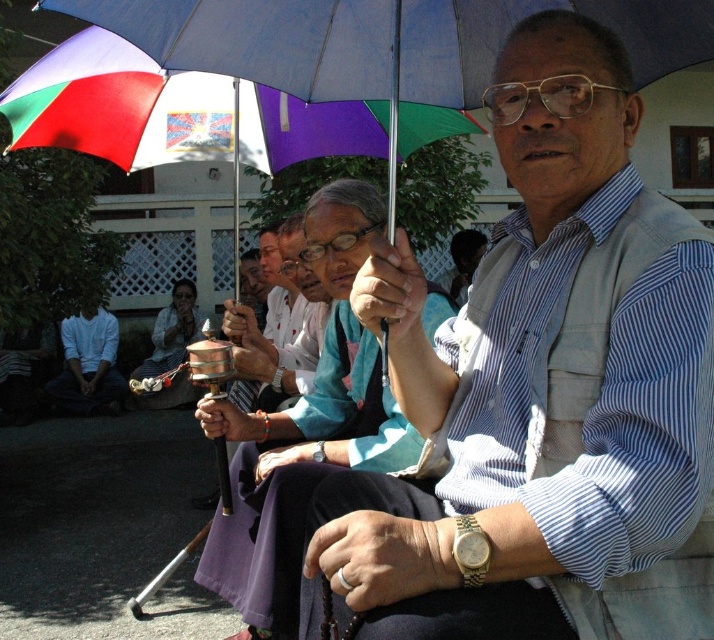
Who is positioned more to the left, matte blue shirt at center or white matte shirt at lower left?

Positioned to the left is white matte shirt at lower left.

Who is higher up, matte blue shirt at center or white matte shirt at lower left?

matte blue shirt at center is higher up.

Image resolution: width=714 pixels, height=640 pixels. What do you see at coordinates (527, 387) in the screenshot? I see `matte blue shirt at center` at bounding box center [527, 387].

At what (x,y) coordinates should I click in order to perform the action: click on matte blue shirt at center. Please return your answer as a coordinate pair (x, y). Looking at the image, I should click on (527, 387).

Does matte blue shirt at center have a lesser height compared to multicolored fabric umbrella at upper center?

No, matte blue shirt at center is not shorter than multicolored fabric umbrella at upper center.

Can you confirm if matte blue shirt at center is positioned to the left of multicolored fabric umbrella at upper center?

No, matte blue shirt at center is not to the left of multicolored fabric umbrella at upper center.

Measure the distance between matte blue shirt at center and camera.

matte blue shirt at center and camera are 1.17 meters apart from each other.

Find the location of `matte blue shirt at center`. matte blue shirt at center is located at coordinates (527, 387).

Does matte black umbrella at center have a lesser width compared to multicolored fabric umbrella at upper center?

Indeed, matte black umbrella at center has a lesser width compared to multicolored fabric umbrella at upper center.

Is matte black umbrella at center bigger than multicolored fabric umbrella at upper center?

Correct, matte black umbrella at center is larger in size than multicolored fabric umbrella at upper center.

The image size is (714, 640). What do you see at coordinates (306, 428) in the screenshot?
I see `matte black umbrella at center` at bounding box center [306, 428].

Find the location of a particular element. matte black umbrella at center is located at coordinates (306, 428).